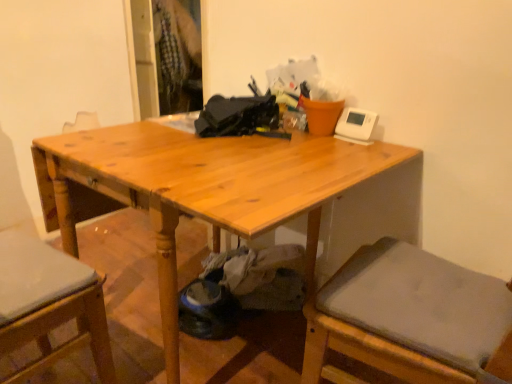
Question: Is the depth of wooden chair at left less than that of light brown wood table at center?

Choices:
 (A) no
 (B) yes

Answer: (B)

Question: Considering the relative positions of wooden chair at left and light brown wood table at center in the image provided, is wooden chair at left behind light brown wood table at center?

Choices:
 (A) no
 (B) yes

Answer: (A)

Question: From the image's perspective, does wooden chair at left appear lower than light brown wood table at center?

Choices:
 (A) yes
 (B) no

Answer: (A)

Question: Can you see wooden chair at left touching light brown wood table at center?

Choices:
 (A) no
 (B) yes

Answer: (A)

Question: Is wooden chair at left at the left side of light brown wood table at center?

Choices:
 (A) no
 (B) yes

Answer: (B)

Question: From the image's perspective, is wooden chair at left on light brown wood table at center?

Choices:
 (A) yes
 (B) no

Answer: (B)

Question: From a real-world perspective, is light brown wood table at center positioned under wooden chair at left based on gravity?

Choices:
 (A) no
 (B) yes

Answer: (B)

Question: Can you confirm if light brown wood table at center is taller than wooden chair at left?

Choices:
 (A) yes
 (B) no

Answer: (B)

Question: Is light brown wood table at center to the right of wooden chair at left from the viewer's perspective?

Choices:
 (A) yes
 (B) no

Answer: (A)

Question: Is light brown wood table at center located outside wooden chair at left?

Choices:
 (A) yes
 (B) no

Answer: (A)

Question: Can you confirm if light brown wood table at center is thinner than wooden chair at left?

Choices:
 (A) yes
 (B) no

Answer: (B)

Question: From the image's perspective, is light brown wood table at center on wooden chair at left?

Choices:
 (A) no
 (B) yes

Answer: (B)

Question: Does point (110, 150) appear closer or farther from the camera than point (22, 369)?

Choices:
 (A) farther
 (B) closer

Answer: (A)